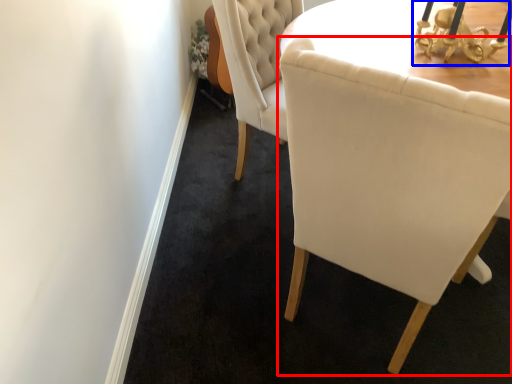
Question: Which point is further to the camera, chair (highlighted by a red box) or table lamp (highlighted by a blue box)?

Choices:
 (A) chair
 (B) table lamp

Answer: (B)